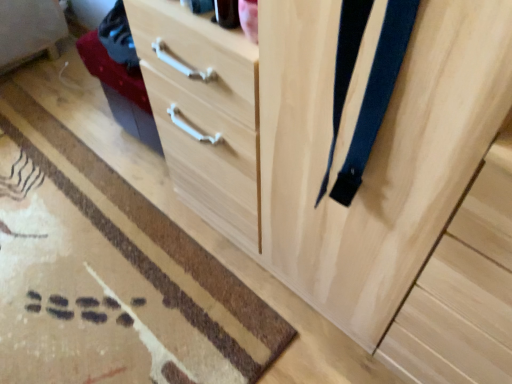
Find the location of a particular element. This screenshot has width=512, height=384. empty space that is ontop of brown woven mat at lower left (from a real-world perspective) is located at coordinates (98, 217).